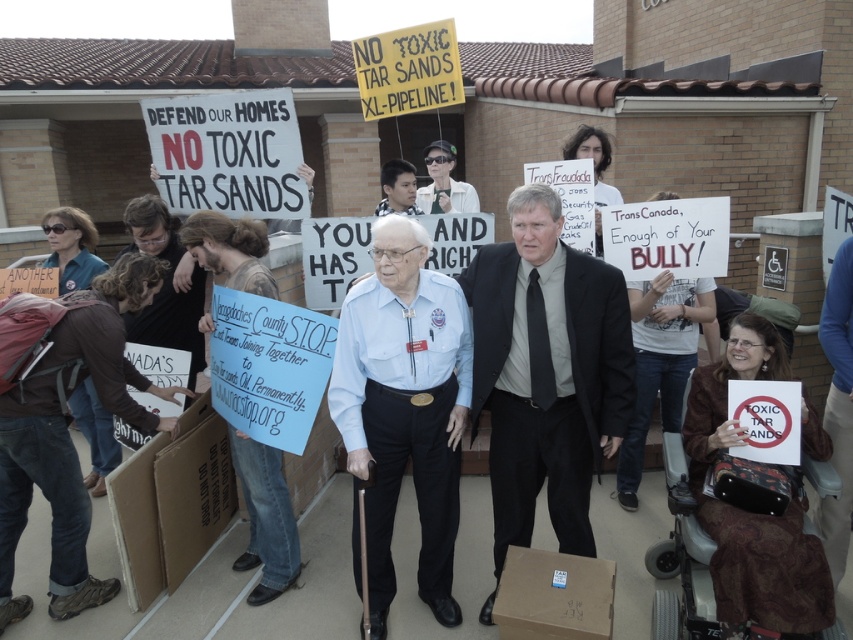
Does black suit at center have a greater height compared to brown cardboard box at lower left?

Yes, black suit at center is taller than brown cardboard box at lower left.

Can you confirm if black suit at center is smaller than brown cardboard box at lower left?

No.

Is point (555, 387) positioned behind point (231, 497)?

No, it is not.

I want to click on black suit at center, so click(x=544, y=372).

Which of these two, black suit at center or brown cardboard box at lower center, stands shorter?

brown cardboard box at lower center

Can you confirm if black suit at center is shorter than brown cardboard box at lower center?

No, black suit at center is not shorter than brown cardboard box at lower center.

You are a GUI agent. You are given a task and a screenshot of the screen. Output one action in this format:
    pyautogui.click(x=<x>, y=<y>)
    Task: Click on the black suit at center
    The image size is (853, 640).
    Given the screenshot: What is the action you would take?
    pyautogui.click(x=544, y=372)

Identify the location of black suit at center. (544, 372).

Does light blue uniform at center have a lesser width compared to brown cardboard box at lower left?

No.

Identify the location of light blue uniform at center. (404, 406).

The width and height of the screenshot is (853, 640). Identify the location of light blue uniform at center. (404, 406).